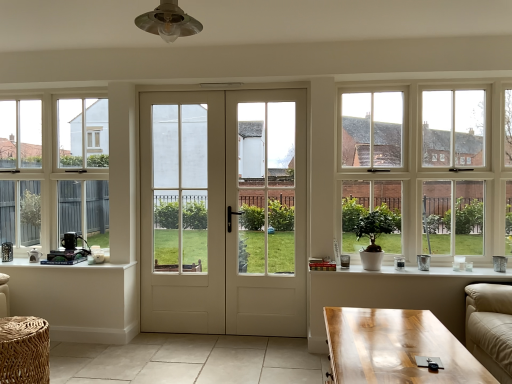
Question: Considering the relative positions of white ceramic pot at lower right and white glass door at center, which is counted as the 1th screen door, starting from the left, in the image provided, is white ceramic pot at lower right to the left or to the right of white glass door at center, which is counted as the 1th screen door, starting from the left,?

Choices:
 (A) left
 (B) right

Answer: (B)

Question: In terms of width, does white ceramic pot at lower right look wider or thinner when compared to white glass door at center, which is the second screen door in right-to-left order?

Choices:
 (A) wide
 (B) thin

Answer: (A)

Question: Which of these objects is positioned closest to the white ceramic pot at lower right?

Choices:
 (A) white matte table at lower left, which ranks as the 2th table in front-to-back order
 (B) white glass door at center, which is the second screen door in right-to-left order
 (C) woven rattan table at lower left, which is the second table in back-to-front order
 (D) light brown wooden coffee table at lower right
 (E) green glossy plant at right

Answer: (E)

Question: Based on their relative distances, which object is farther from the white ceramic pot at lower right?

Choices:
 (A) light brown wooden coffee table at lower right
 (B) white smooth door at center
 (C) woven rattan table at lower left, which is the 1th table from front to back
 (D) white glossy door at center, the second screen door from the left
 (E) white glass door at center, which is the second screen door in right-to-left order

Answer: (C)